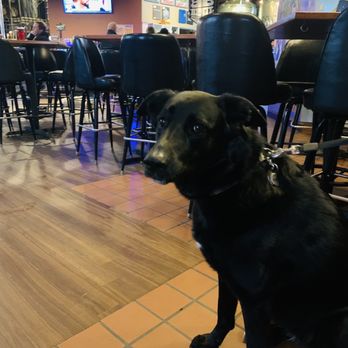
You are a GUI agent. You are given a task and a screenshot of the screen. Output one action in this format:
    pyautogui.click(x=<x>, y=<y>)
    Task: Click on the chair
    This screenshot has width=348, height=348.
    Given the screenshot: What is the action you would take?
    [253, 76], [296, 57], [153, 54], [81, 58], [40, 58], [6, 58]